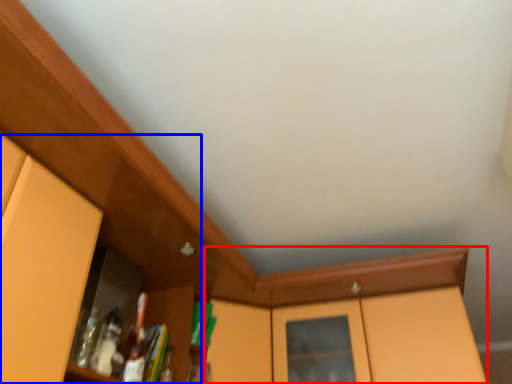
Question: Which object appears farthest to the camera in this image, cabinetry (highlighted by a red box) or dresser (highlighted by a blue box)?

Choices:
 (A) cabinetry
 (B) dresser

Answer: (A)